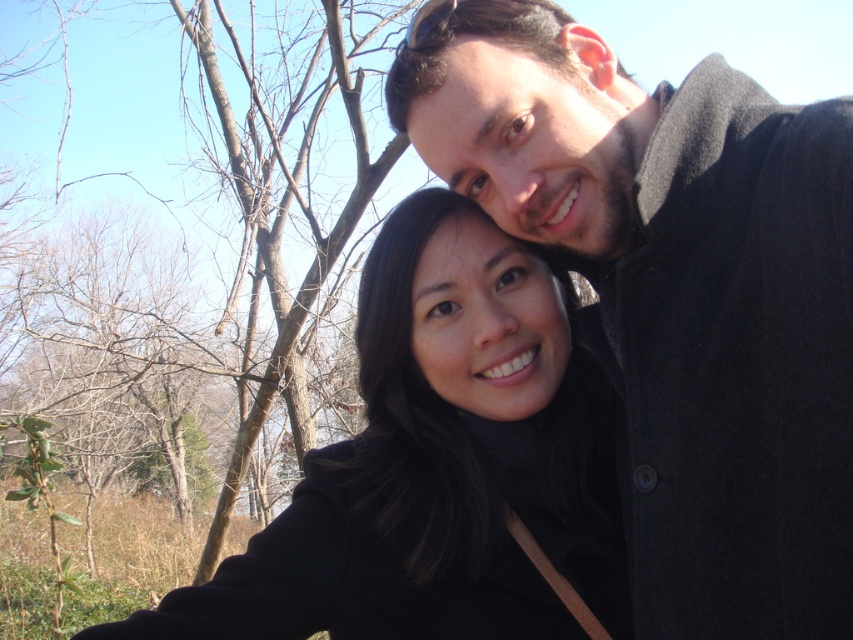
Question: Which object is the closest to the brown leafless tree at left?

Choices:
 (A) dark gray wool coat at upper right
 (B) black matte coat at center

Answer: (B)

Question: Based on their relative distances, which object is farther from the black matte coat at center?

Choices:
 (A) brown leafless tree at left
 (B) dark gray wool coat at upper right

Answer: (A)

Question: Can you confirm if dark gray wool coat at upper right is bigger than brown leafless tree at left?

Choices:
 (A) yes
 (B) no

Answer: (B)

Question: Which point is farther from the camera taking this photo?

Choices:
 (A) (552, 417)
 (B) (231, 147)
 (C) (775, 532)

Answer: (B)

Question: Where is dark gray wool coat at upper right located in relation to black matte coat at center in the image?

Choices:
 (A) right
 (B) left

Answer: (A)

Question: Observing the image, what is the correct spatial positioning of dark gray wool coat at upper right in reference to brown leafless tree at left?

Choices:
 (A) right
 (B) left

Answer: (A)